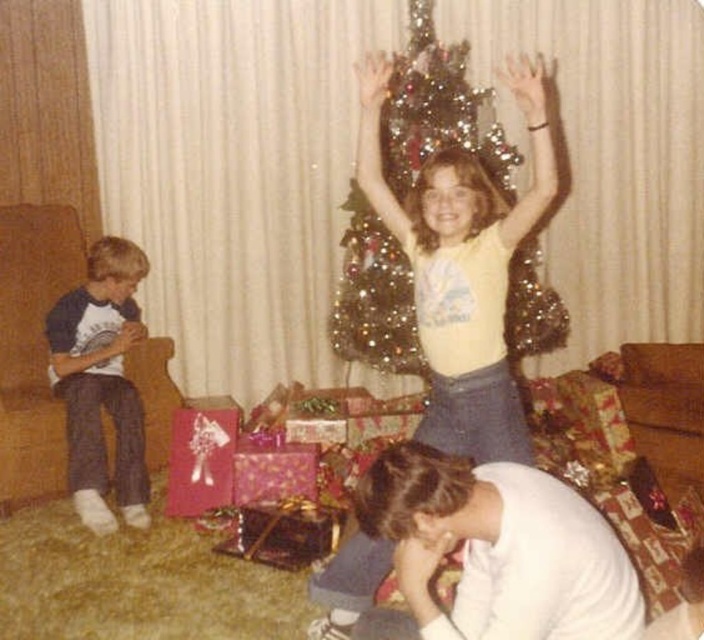
Question: Which object is positioned farthest from the shiny metallic tree at center?

Choices:
 (A) dark blue cotton shirt at left
 (B) yellow matte shirt at center
 (C) white soft shirt at lower center

Answer: (C)

Question: Which object appears closest to the camera in this image?

Choices:
 (A) shiny metallic gift at lower center
 (B) shiny metallic tree at center
 (C) yellow matte shirt at center
 (D) dark blue cotton shirt at left

Answer: (C)

Question: Which of these objects is positioned closest to the white soft shirt at lower center?

Choices:
 (A) yellow matte shirt at center
 (B) shiny metallic gift at lower center

Answer: (A)

Question: Is yellow matte shirt at center thinner than white soft shirt at lower center?

Choices:
 (A) no
 (B) yes

Answer: (B)

Question: Is yellow matte shirt at center to the right of dark blue cotton shirt at left from the viewer's perspective?

Choices:
 (A) no
 (B) yes

Answer: (B)

Question: Can you confirm if shiny metallic tree at center is positioned to the right of dark blue cotton shirt at left?

Choices:
 (A) no
 (B) yes

Answer: (B)